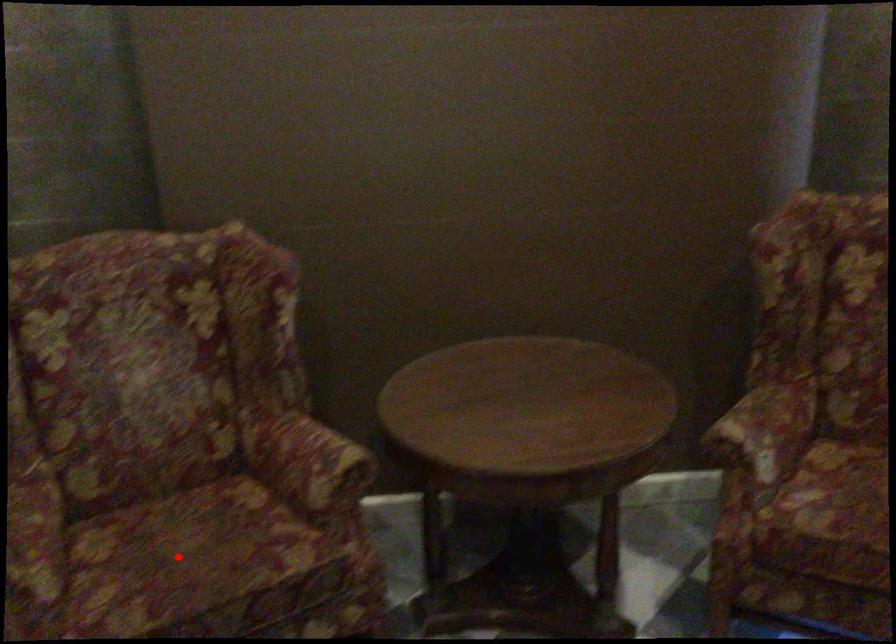
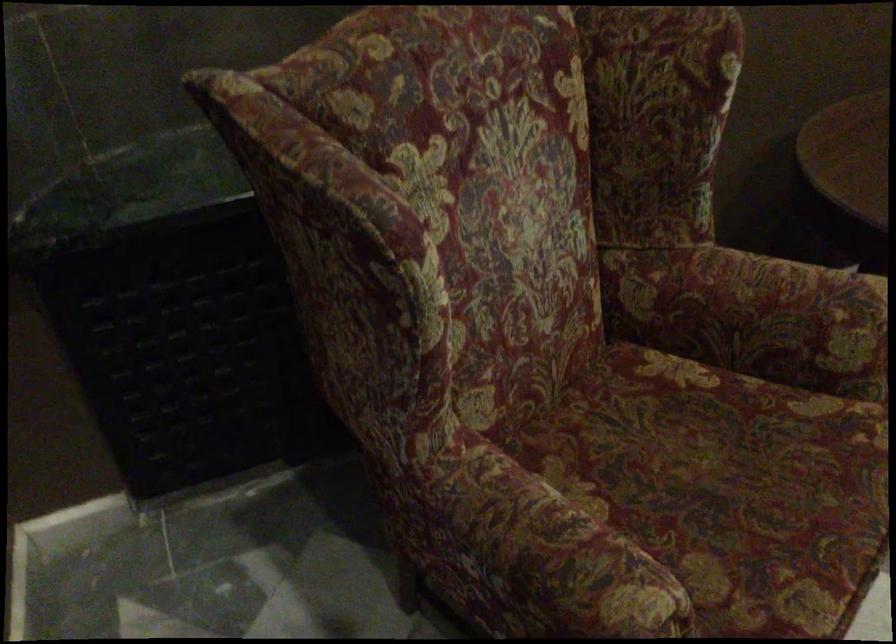
Question: I am providing you with two images of the same scene from different viewpoints. In image1, a red point is highlighted. Considering the same 3D point in image2, which of the following is correct?

Choices:
 (A) It is closer
 (B) It is farther

Answer: (A)